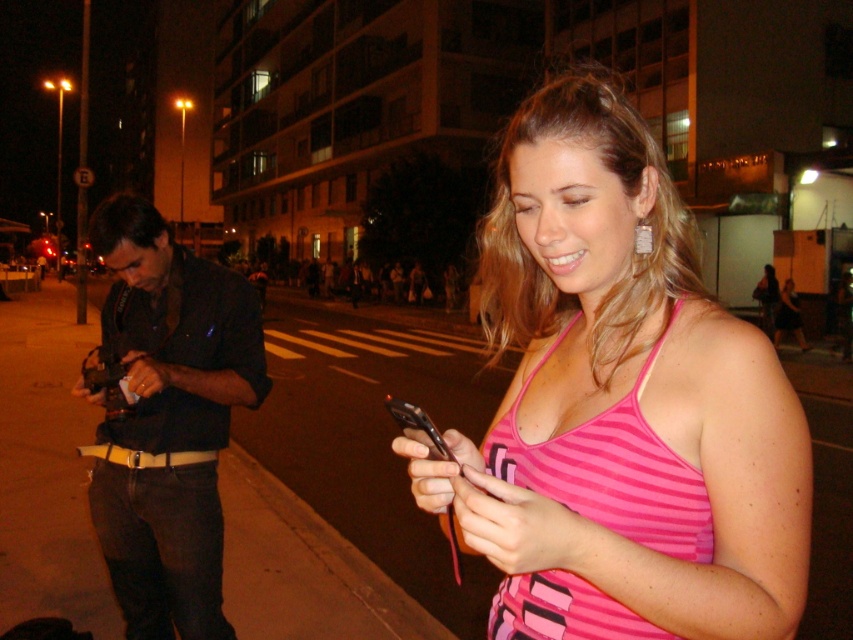
You are a pedestrian walking down the street and notice both the black leather shirt at left and the black plastic sign at upper center. Which object is closer to you from your perspective?

The black leather shirt at left is closer to you because it is positioned in front of the black plastic sign at upper center.

You are designing a poster for a summer event and need to include both the pink striped bikini top at center and the black plastic sign at upper center. Which object should be placed first in terms of width if you want to prioritize the wider one?

The black plastic sign at upper center should be placed first because its width is greater than the pink striped bikini top at center.

You are a fashion designer observing the nighttime urban scene. You notice the black leather shirt at left and the black plastic sign at upper center. Which object has a greater height?

The black leather shirt at left has a greater height compared to the black plastic sign at upper center.